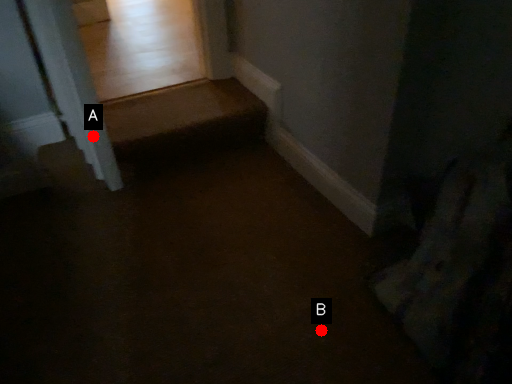
Question: Two points are circled on the image, labeled by A and B beside each circle. Which point is further to the camera?

Choices:
 (A) A is further
 (B) B is further

Answer: (A)